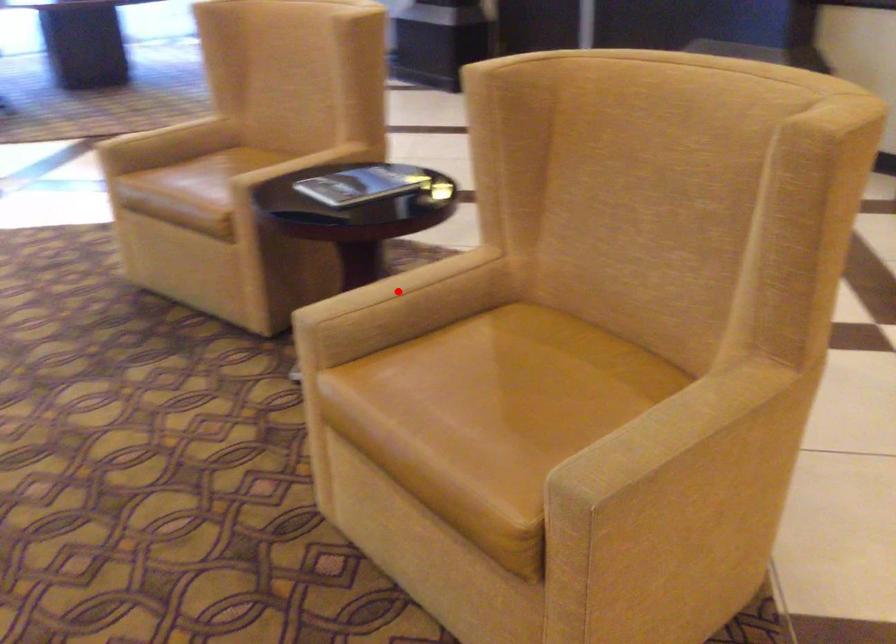
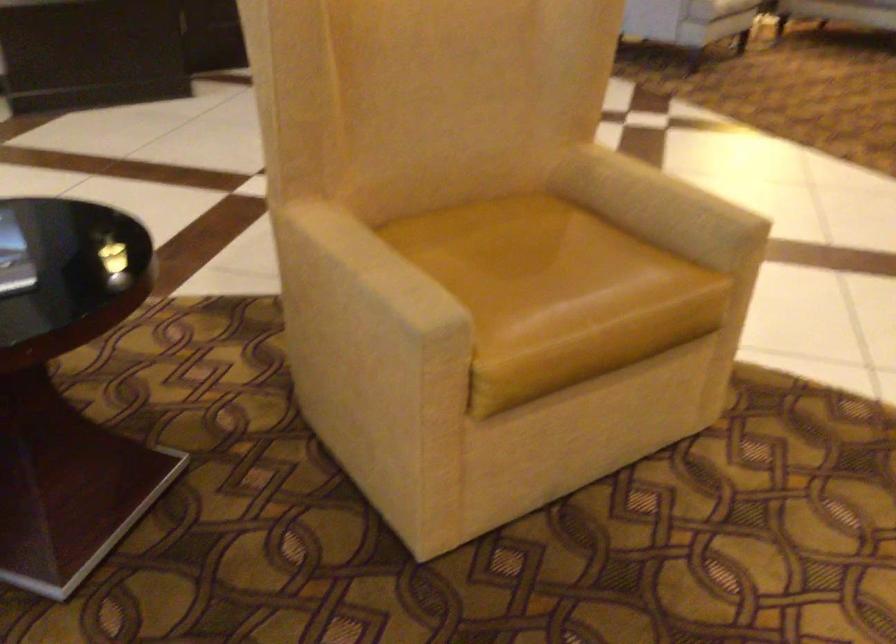
Find the pixel in the second image that matches the highlighted location in the first image.

(375, 266)